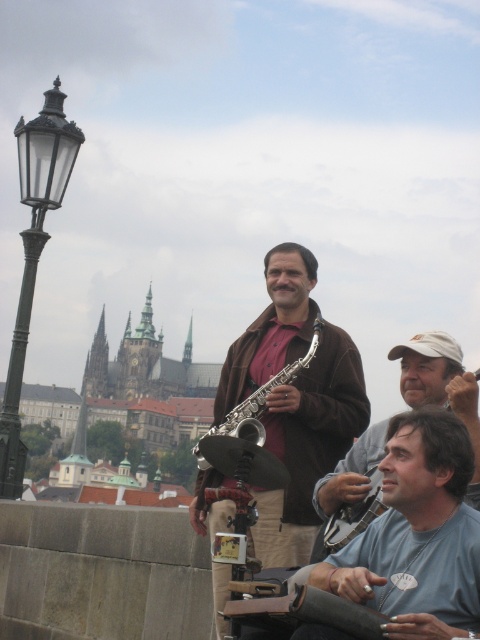
What are the coordinates of `matte brown saxophone at center` in the screenshot? It's located at (441, 385).

Image resolution: width=480 pixels, height=640 pixels. In order to click on matte brown saxophone at center in this screenshot , I will do `click(441, 385)`.

Is brown suede jacket at center wider than black glass lamp post at left?

Indeed, brown suede jacket at center has a greater width compared to black glass lamp post at left.

Does point (349, 406) lie behind point (74, 150)?

Yes.

Who is more forward, (285, 445) or (60, 138)?

Point (60, 138) is in front.

Find the location of a particular element. Image resolution: width=480 pixels, height=640 pixels. brown suede jacket at center is located at coordinates (308, 445).

What do you see at coordinates (264, 394) in the screenshot?
I see `silver metallic saxophone at center` at bounding box center [264, 394].

Does silver metallic saxophone at center have a larger size compared to metallic silver saxophone at center?

Yes.

You are a GUI agent. You are given a task and a screenshot of the screen. Output one action in this format:
    pyautogui.click(x=<x>, y=<y>)
    Task: Click on the silver metallic saxophone at center
    The image size is (480, 640).
    Given the screenshot: What is the action you would take?
    pyautogui.click(x=264, y=394)

The image size is (480, 640). I want to click on silver metallic saxophone at center, so click(264, 394).